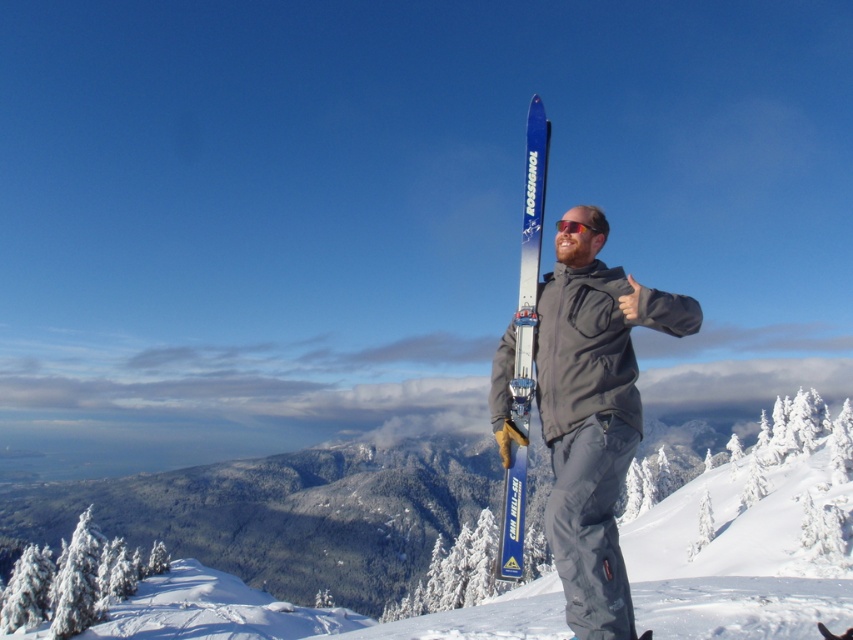
Question: Which object is the closest to the blue metallic ski at center?

Choices:
 (A) shiny orange sunglasses at center
 (B) matte gray jacket at center
 (C) white powder snow at center

Answer: (B)

Question: Is white powder snow at center closer to the viewer compared to blue metallic ski at center?

Choices:
 (A) no
 (B) yes

Answer: (B)

Question: Which of the following is the closest to the observer?

Choices:
 (A) (560, 220)
 (B) (640, 525)
 (C) (558, 342)

Answer: (C)

Question: Among these objects, which one is nearest to the camera?

Choices:
 (A) shiny orange sunglasses at center
 (B) white powder snow at center
 (C) blue metallic ski at center
 (D) matte gray jacket at center

Answer: (D)

Question: Does matte gray jacket at center come behind shiny orange sunglasses at center?

Choices:
 (A) yes
 (B) no

Answer: (B)

Question: Can you confirm if matte gray jacket at center is positioned above shiny orange sunglasses at center?

Choices:
 (A) yes
 (B) no

Answer: (B)